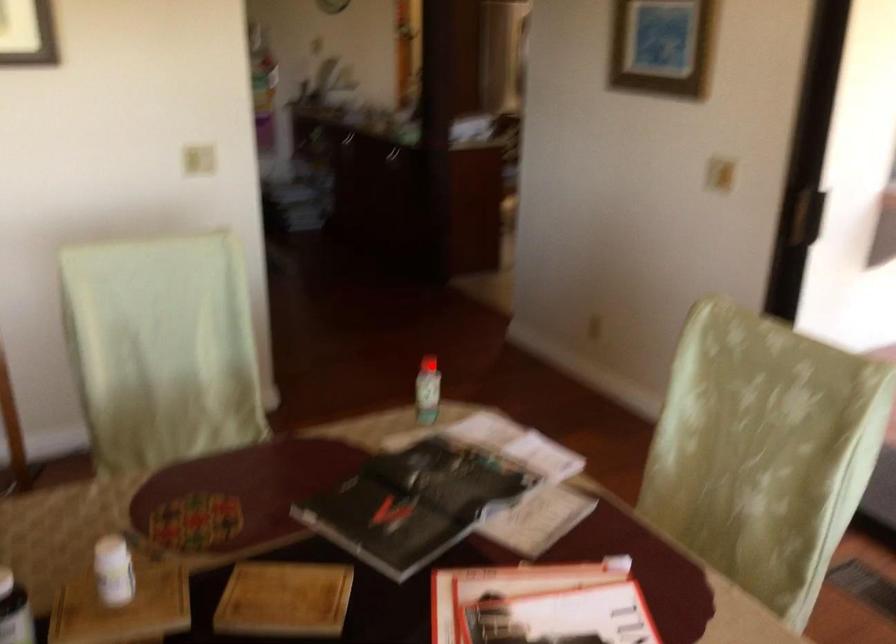
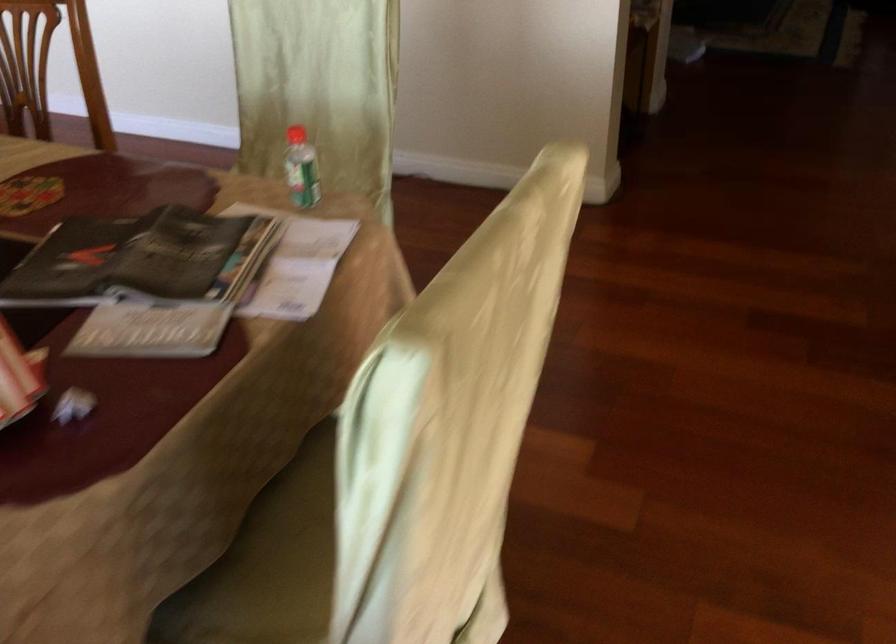
The point at the highlighted location is marked in the first image. Where is the corresponding point in the second image?

(296, 135)